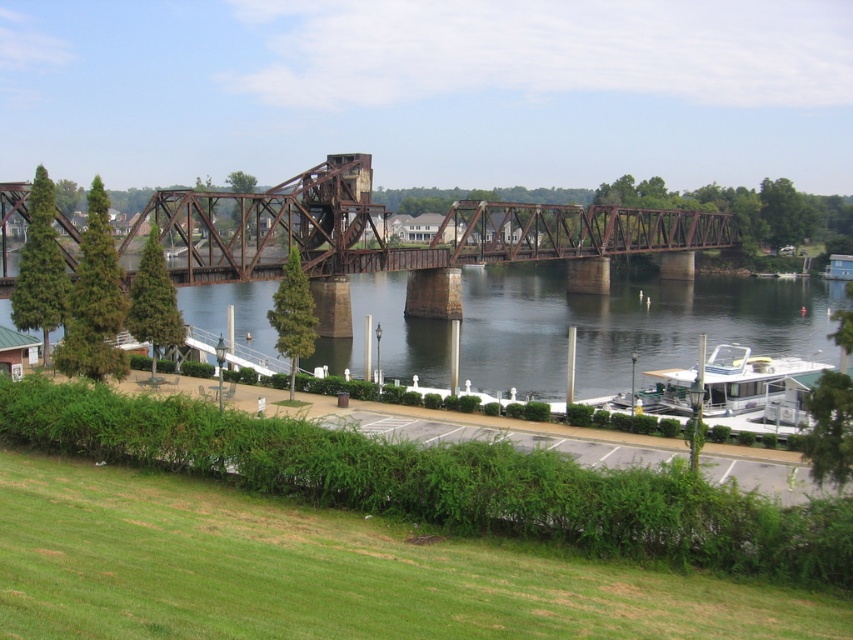
You are standing at the edge of the parking lot and want to walk towards the bridge. You notice two points marked on the ground in front of you. The first point is at coordinate point[804,298] and the second is at point[752,369]. Which point should you step on first if you want to reach the bridge first?

You should step on point[804,298] first because it is closer to you than point[752,369]. Since point[804,298] is further to the viewer, it means it is nearer to your current position at the edge of the parking lot, so stepping on it first would bring you closer to the bridge more quickly.

You are standing at the point marked as point [627,324] in the image. What is the color of the object directly beneath your feet?

The dark brown water at center is located at point [627,324], so the color beneath your feet is dark brown.